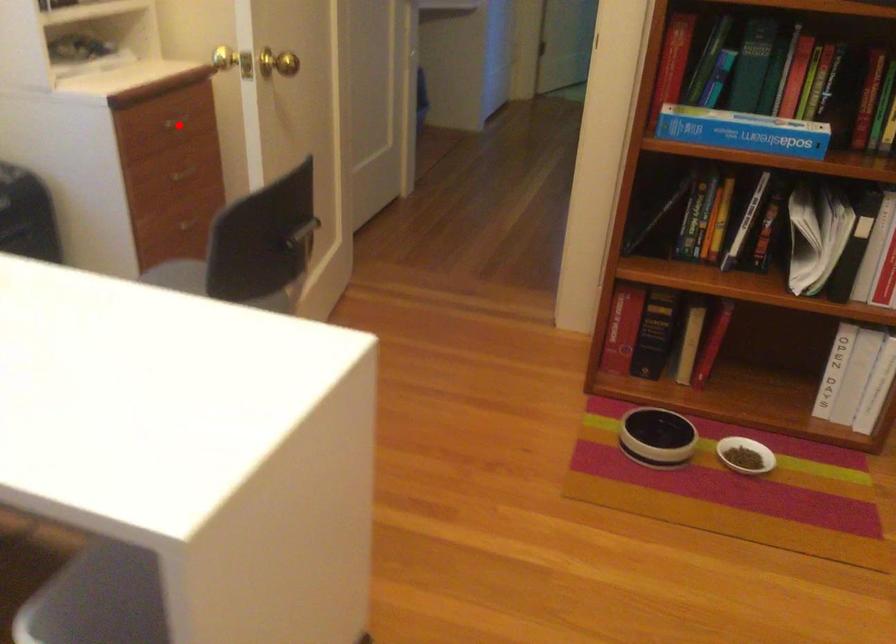
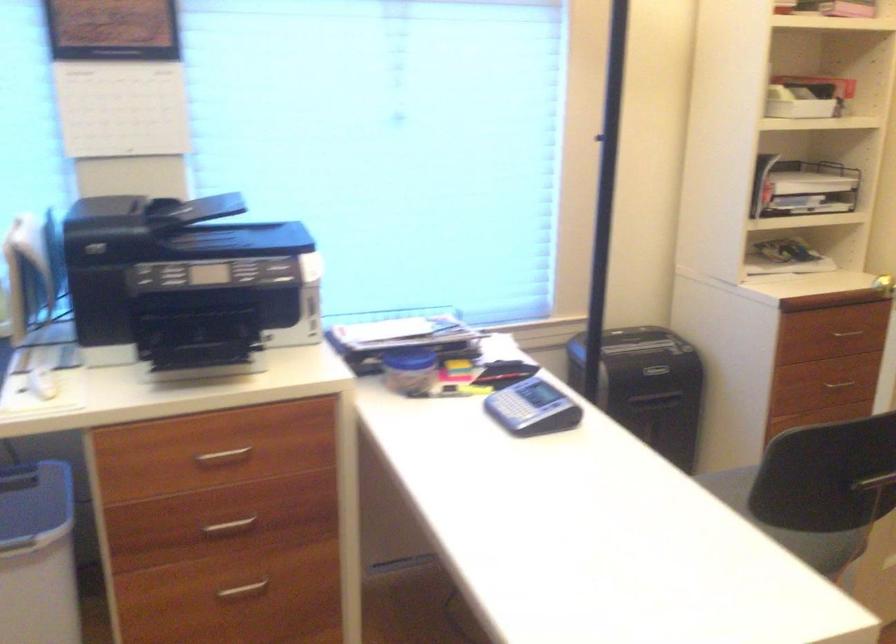
Question: I am providing you with two images of the same scene from different viewpoints. A red point is marked on the first image. Is the red point's position out of view in image 2?

Choices:
 (A) Yes
 (B) No

Answer: (B)